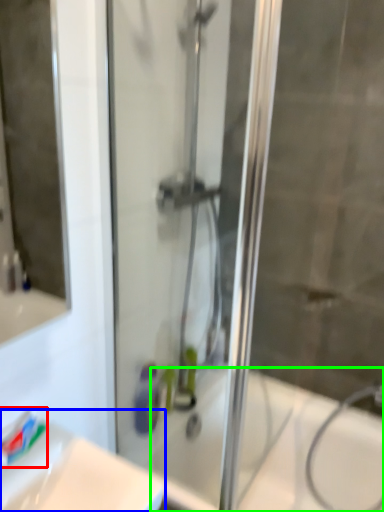
Question: Which is farther away from toothpaste (highlighted by a red box)? sink (highlighted by a blue box) or bath (highlighted by a green box)?

Choices:
 (A) sink
 (B) bath

Answer: (B)